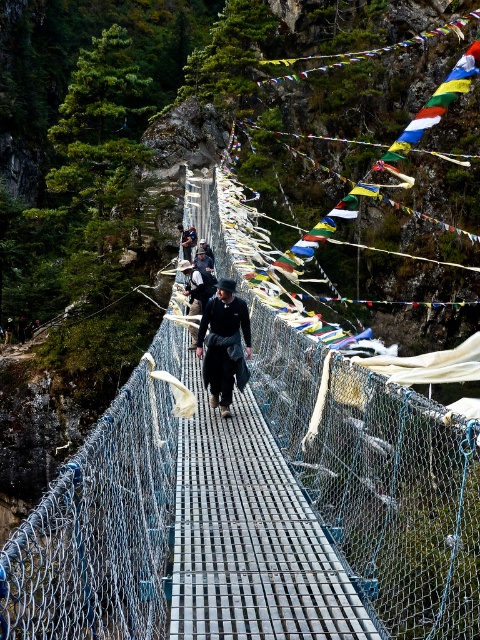
Is blue mesh bridge at center smaller than black matte jacket at center?

Actually, blue mesh bridge at center might be larger than black matte jacket at center.

Between point (301, 424) and point (197, 333), which one is positioned behind?

Point (197, 333)

Does point (307, 582) come farther from viewer compared to point (227, 387)?

That is False.

Find the location of a particular element. The height and width of the screenshot is (640, 480). blue mesh bridge at center is located at coordinates (255, 509).